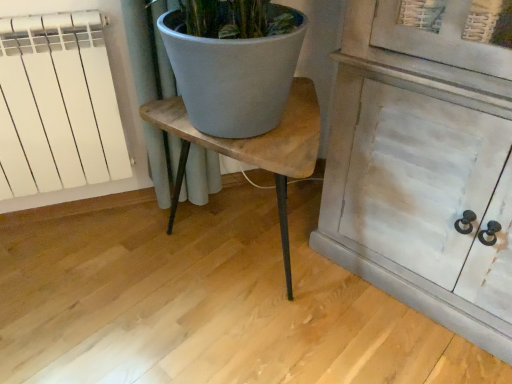
Question: Should I look upward or downward to see wooden table at center?

Choices:
 (A) up
 (B) down

Answer: (A)

Question: Considering the relative sizes of white matte radiator at left and wooden table at center in the image provided, is white matte radiator at left shorter than wooden table at center?

Choices:
 (A) no
 (B) yes

Answer: (A)

Question: Considering the relative sizes of white matte radiator at left and wooden table at center in the image provided, is white matte radiator at left thinner than wooden table at center?

Choices:
 (A) no
 (B) yes

Answer: (B)

Question: Does white matte radiator at left have a greater height compared to wooden table at center?

Choices:
 (A) no
 (B) yes

Answer: (B)

Question: Are white matte radiator at left and wooden table at center located far from each other?

Choices:
 (A) yes
 (B) no

Answer: (B)

Question: Could you tell me if white matte radiator at left is turned towards wooden table at center?

Choices:
 (A) yes
 (B) no

Answer: (B)

Question: Is white matte radiator at left oriented away from wooden table at center?

Choices:
 (A) no
 (B) yes

Answer: (A)

Question: Considering the relative sizes of wooden table at center and white matte radiator at left in the image provided, is wooden table at center smaller than white matte radiator at left?

Choices:
 (A) yes
 (B) no

Answer: (B)

Question: Does wooden table at center lie behind white matte radiator at left?

Choices:
 (A) yes
 (B) no

Answer: (B)

Question: Considering the relative positions of wooden table at center and white matte radiator at left in the image provided, is wooden table at center to the right of white matte radiator at left from the viewer's perspective?

Choices:
 (A) no
 (B) yes

Answer: (B)

Question: Is wooden table at center shorter than white matte radiator at left?

Choices:
 (A) no
 (B) yes

Answer: (B)

Question: Considering the relative sizes of wooden table at center and white matte radiator at left in the image provided, is wooden table at center taller than white matte radiator at left?

Choices:
 (A) no
 (B) yes

Answer: (A)

Question: Does wooden table at center appear on the left side of white matte radiator at left?

Choices:
 (A) no
 (B) yes

Answer: (A)

Question: Is point (269, 170) closer or farther from the camera than point (117, 178)?

Choices:
 (A) farther
 (B) closer

Answer: (B)